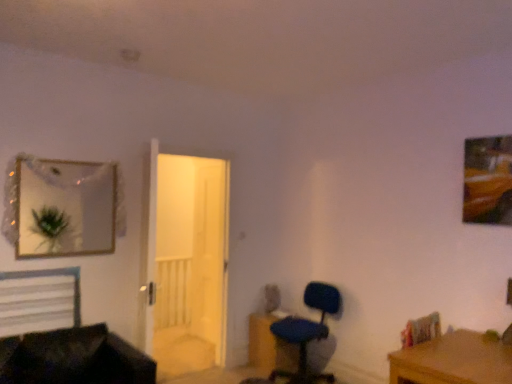
This screenshot has height=384, width=512. Identify the location of free spot above matte silver mirror at upper left (from a real-world perspective). (64, 153).